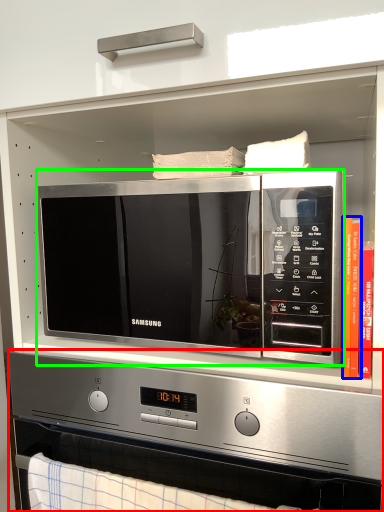
Question: Estimate the real-world distances between objects in this image. Which object is farther from appliance (highlighted by a red box), book (highlighted by a blue box) or microwave oven (highlighted by a green box)?

Choices:
 (A) book
 (B) microwave oven

Answer: (A)